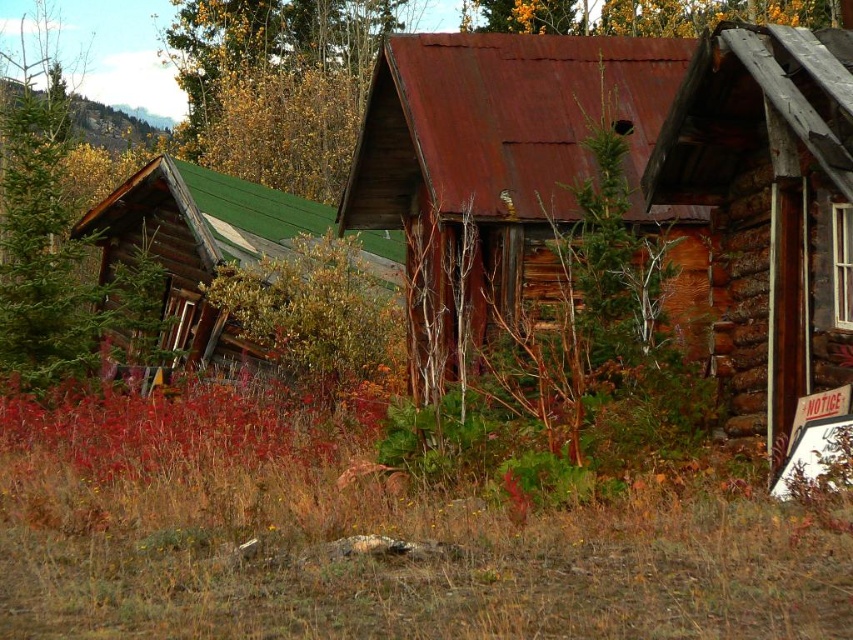
You are a hiker who wants to take a photo of the rusty metal hut at center and the green wood tree at upper left. Which object should you focus on first if you want to capture both in the same frame without moving your camera?

The rusty metal hut at center is not as tall as the green wood tree at upper left, so you should focus on the green wood tree at upper left first to ensure it fits within the frame.

Based on the scene description, what are the coordinates of the weathered wood log cabin at right?

The coordinates of the weathered wood log cabin at right are at point (769, 209).